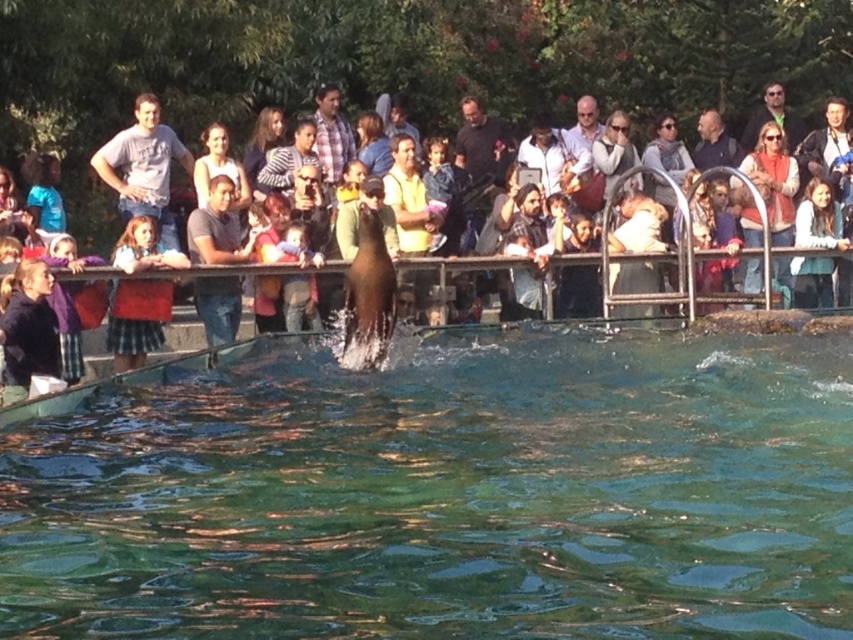
You are a photographer at the marine show and want to capture a photo that includes both the dark blue jacket at left and the light brown hair at upper right. Which object should you focus on first if you want to ensure both are in frame?

The dark blue jacket at left is positioned on the left side of light brown hair at upper right, so you should focus on the dark blue jacket at left first to ensure both are in frame.

You are a photographer standing at the camera position. You want to take a photo of the sea lion mid jump but need to ensure the dark blue jacket at left won not be in the frame. Given that the jacket is 21.64 meters away from you, what is the minimum distance you should keep between the jacket and the sea lion to prevent the jacket from appearing in your photo?

The dark blue jacket at left is 21.64 meters away from the camera. To prevent it from appearing in the photo, the sea lion should be positioned closer than 21.64 meters to the camera so that the jacket is out of the frame.

You are a photographer standing at the edge of the marine animal show enclosure. You notice a point marked at coordinates (143, 166) in the image. What object is located at that point?

The point at coordinates (143, 166) marks the location of the matte gray tshirt at upper left.